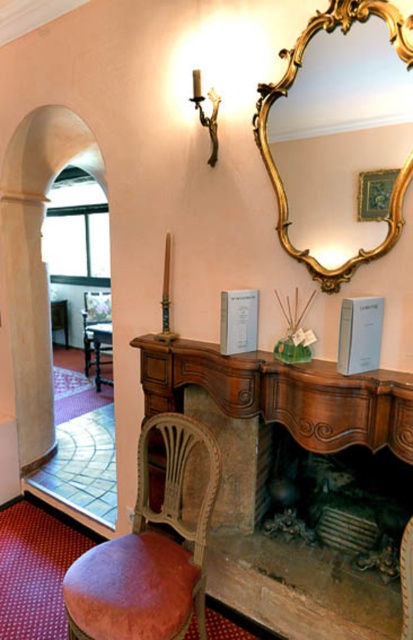
Question: Which point is closer to the camera?

Choices:
 (A) green fabric picture frame at upper center
 (B) wooden fireplace at center
 (C) wooden armchair at left

Answer: (B)

Question: Which object is positioned closest to the green fabric picture frame at upper center?

Choices:
 (A) wooden armchair at left
 (B) wooden fireplace at center
 (C) gold ornate mirror at upper center
 (D) velvet red armchair at lower left

Answer: (C)

Question: Does gold ornate mirror at upper center have a larger size compared to wooden armchair at left?

Choices:
 (A) yes
 (B) no

Answer: (B)

Question: Can you confirm if wooden fireplace at center is positioned to the left of green fabric picture frame at upper center?

Choices:
 (A) no
 (B) yes

Answer: (B)

Question: Which object appears farthest from the camera in this image?

Choices:
 (A) gold ornate mirror at upper center
 (B) velvet red armchair at lower left
 (C) wooden armchair at left

Answer: (C)

Question: In this image, where is wooden armchair at left located relative to green fabric picture frame at upper center?

Choices:
 (A) above
 (B) below

Answer: (B)